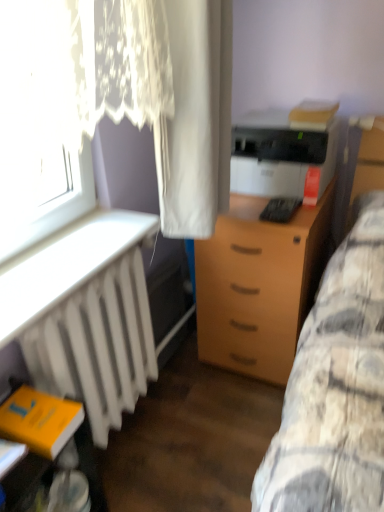
Question: In the image, is white fabric curtain at center, marked as the 1th curtain in a right-to-left arrangement, positioned in front of or behind yellow matte book at lower left?

Choices:
 (A) front
 (B) behind

Answer: (A)

Question: Considering the positions of white fabric curtain at center, the 2th curtain in the left-to-right sequence, and yellow matte book at lower left in the image, is white fabric curtain at center, the 2th curtain in the left-to-right sequence, taller or shorter than yellow matte book at lower left?

Choices:
 (A) tall
 (B) short

Answer: (A)

Question: Which object is the farthest from the black plastic keyboard at center?

Choices:
 (A) matte black printer at center right
 (B) white matte radiator at lower left
 (C) light brown wood drawer at center
 (D) white sheer curtain at upper left, which appears as the 1th curtain when viewed from the left
 (E) white plastic radiator at left

Answer: (B)

Question: Estimate the real-world distances between objects in this image. Which object is farther from the white matte radiator at lower left?

Choices:
 (A) matte black printer at center right
 (B) white plastic radiator at left
 (C) white fabric curtain at center, marked as the 1th curtain in a right-to-left arrangement
 (D) black plastic keyboard at center
 (E) yellow matte book at lower left

Answer: (D)